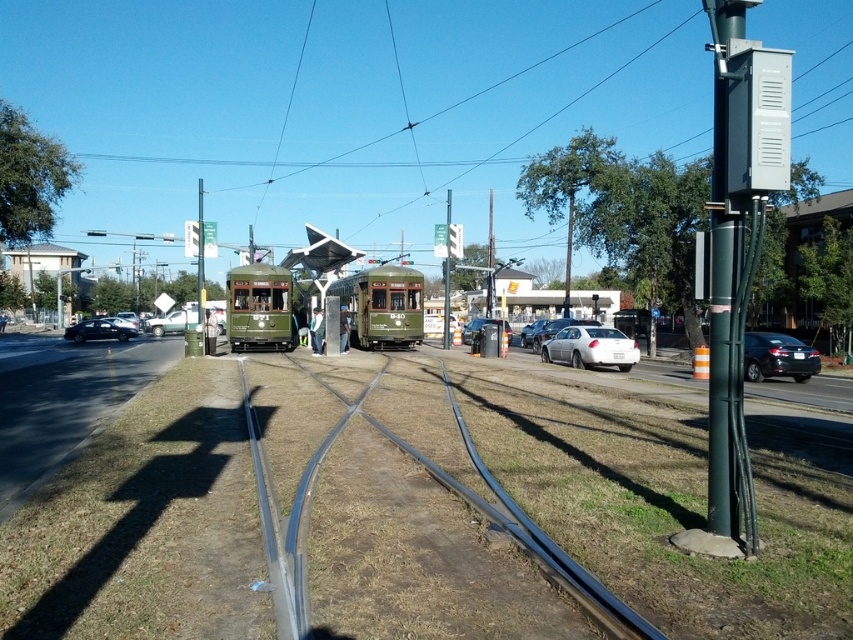
Question: Which point is closer to the camera?

Choices:
 (A) metallic silver sedan at center
 (B) silver metallic sedan at center-right

Answer: (B)

Question: Is metallic gray train track at center to the left of shiny black sedan at left from the viewer's perspective?

Choices:
 (A) yes
 (B) no

Answer: (B)

Question: Is metallic gray train track at center above metallic silver sedan at center-left?

Choices:
 (A) no
 (B) yes

Answer: (A)

Question: Estimate the real-world distances between objects in this image. Which object is closer to the silver metallic sedan at center-right?

Choices:
 (A) satin black sedan at right
 (B) metallic silver sedan at center
 (C) metallic silver sedan at center-left

Answer: (B)

Question: Among these points, which one is farthest from the camera?

Choices:
 (A) (193, 307)
 (B) (450, 394)
 (C) (773, 371)

Answer: (A)

Question: Does silver metallic sedan at center-right appear over metallic silver sedan at center?

Choices:
 (A) no
 (B) yes

Answer: (A)